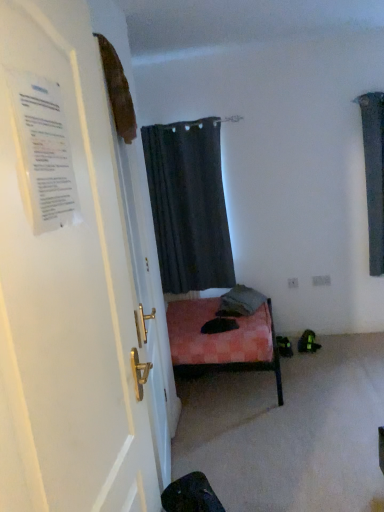
Question: Can you confirm if dark gray fabric curtain at upper center is smaller than white glossy door at left?

Choices:
 (A) yes
 (B) no

Answer: (B)

Question: Are dark gray fabric curtain at upper center and white glossy door at left located far from each other?

Choices:
 (A) no
 (B) yes

Answer: (B)

Question: From the image's perspective, is dark gray fabric curtain at upper center below white glossy door at left?

Choices:
 (A) yes
 (B) no

Answer: (B)

Question: Can you confirm if dark gray fabric curtain at upper center is shorter than white glossy door at left?

Choices:
 (A) no
 (B) yes

Answer: (B)

Question: From a real-world perspective, is dark gray fabric curtain at upper center physically below white glossy door at left?

Choices:
 (A) yes
 (B) no

Answer: (A)

Question: Is dark gray fabric curtain at upper center behind white glossy door at left?

Choices:
 (A) yes
 (B) no

Answer: (A)

Question: From the image's perspective, does white paper at left appear lower than dark gray fabric curtain at upper center?

Choices:
 (A) no
 (B) yes

Answer: (B)

Question: Is white paper at left at the left side of dark gray fabric curtain at upper center?

Choices:
 (A) no
 (B) yes

Answer: (B)

Question: Are white paper at left and dark gray fabric curtain at upper center located far from each other?

Choices:
 (A) no
 (B) yes

Answer: (B)

Question: Is white paper at left not within dark gray fabric curtain at upper center?

Choices:
 (A) no
 (B) yes

Answer: (B)

Question: Is the position of white paper at left more distant than that of dark gray fabric curtain at upper center?

Choices:
 (A) yes
 (B) no

Answer: (B)

Question: Is white paper at left next to dark gray fabric curtain at upper center and touching it?

Choices:
 (A) no
 (B) yes

Answer: (A)

Question: Is white glossy door at left outside dark gray fabric curtain at upper center?

Choices:
 (A) yes
 (B) no

Answer: (A)